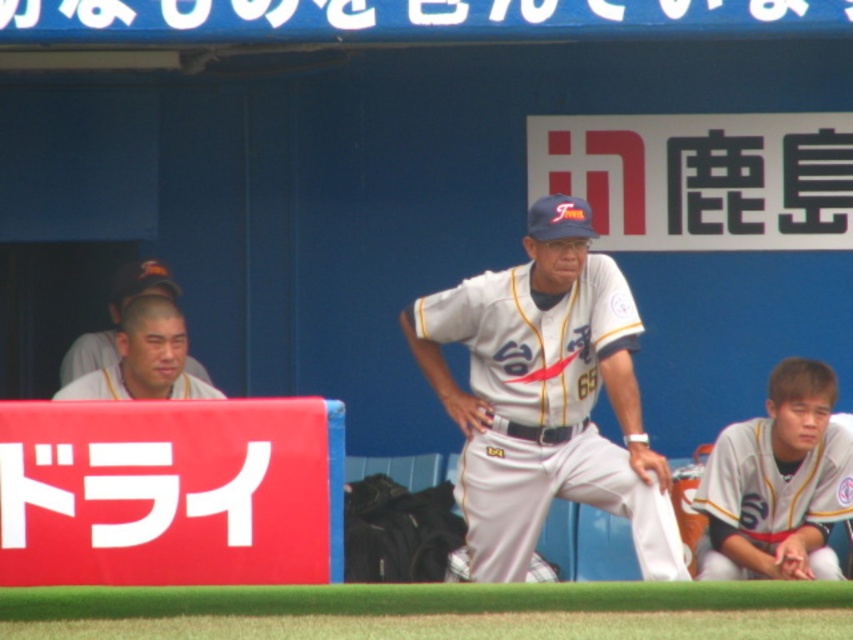
Question: In this image, where is white fabric uniform at center located relative to white uniform at lower right?

Choices:
 (A) right
 (B) left

Answer: (B)

Question: Is white fabric uniform at center positioned before matte gray baseball uniform at left?

Choices:
 (A) yes
 (B) no

Answer: (A)

Question: Does white fabric uniform at center appear under matte gray baseball uniform at left?

Choices:
 (A) no
 (B) yes

Answer: (B)

Question: Estimate the real-world distances between objects in this image. Which object is closer to the matte gray baseball uniform at left?

Choices:
 (A) white uniform at lower right
 (B) matte gray cap at left
 (C) white fabric uniform at center

Answer: (B)

Question: Based on their relative distances, which object is farther from the matte gray cap at left?

Choices:
 (A) matte gray baseball uniform at left
 (B) white uniform at lower right
 (C) white fabric baseball uniform at center

Answer: (B)

Question: Which of these objects is positioned closest to the matte gray baseball uniform at left?

Choices:
 (A) matte gray cap at left
 (B) white fabric baseball uniform at center

Answer: (A)